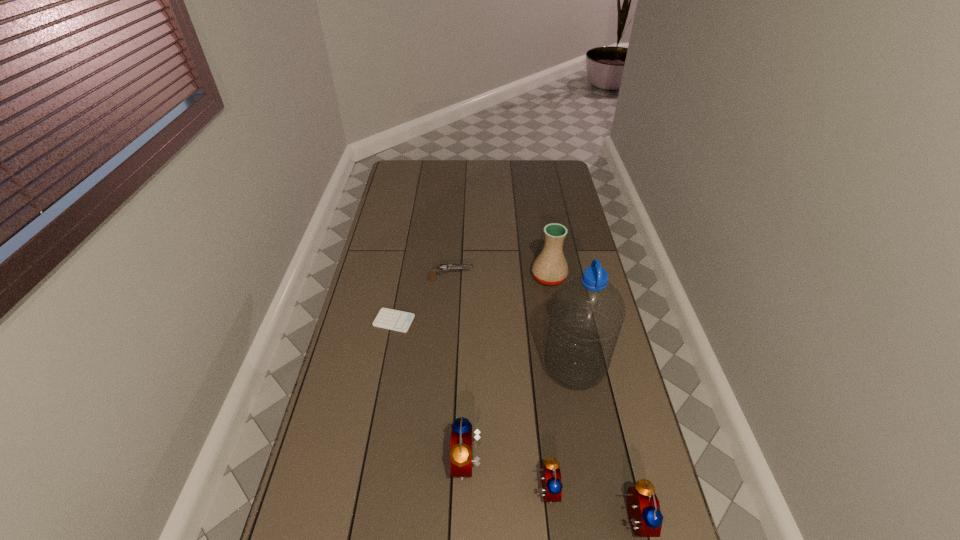
I want to click on free point between the third shortest object and the gun, so coord(498,384).

This screenshot has height=540, width=960. Find the location of `empty space between the shortest alarm clock and the leftmost alarm clock`. empty space between the shortest alarm clock and the leftmost alarm clock is located at coordinates (507, 476).

Locate an element on the screen. This screenshot has height=540, width=960. empty space that is in between the fourth nearest object and the leftmost alarm clock is located at coordinates (520, 415).

The image size is (960, 540). Identify the location of free space between the sixth tallest object and the pottery. (500, 278).

I want to click on free space between the fourth object from left to right and the leftmost alarm clock, so click(507, 476).

The width and height of the screenshot is (960, 540). I want to click on object that is the closest to the leftmost alarm clock, so click(x=552, y=485).

What are the coordinates of `object that can be found as the second closest to the pottery` in the screenshot? It's located at (587, 314).

You are a GUI agent. You are given a task and a screenshot of the screen. Output one action in this format:
    pyautogui.click(x=<x>, y=<y>)
    Task: Click on the second closest alarm clock to the pottery
    Image resolution: width=960 pixels, height=540 pixels.
    Given the screenshot: What is the action you would take?
    pyautogui.click(x=552, y=485)

Choose which alarm clock is the second nearest neighbor to the gun. Please provide its 2D coordinates. Your answer should be formatted as a tuple, i.e. [(x, y)], where the tuple contains the x and y coordinates of a point satisfying the conditions above.

[(552, 485)]

What are the coordinates of `free space that satisfies the following two spatial constraints: 1. aiming along the barrel of the tallest object; 2. on the right side of the second shortest object` in the screenshot? It's located at (444, 368).